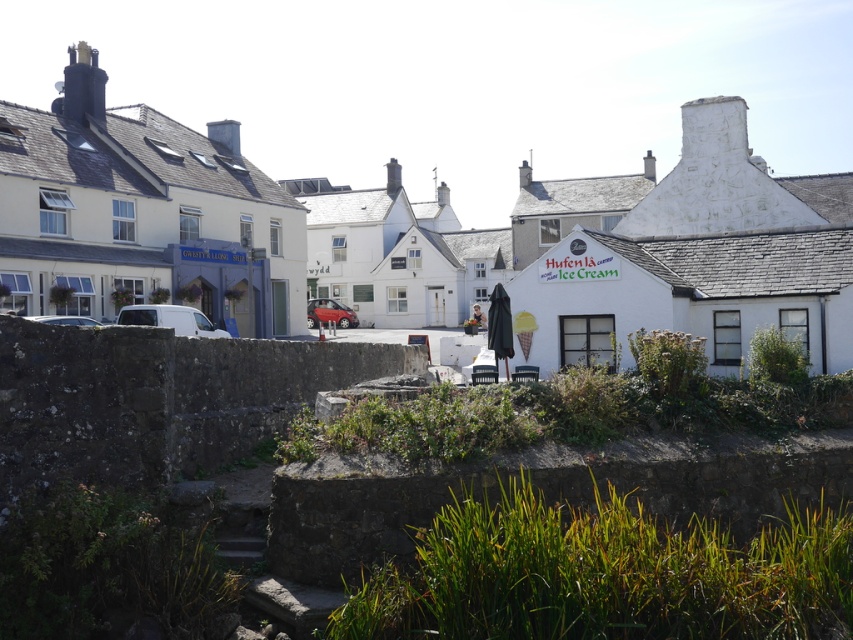
Question: Estimate the real-world distances between objects in this image. Which object is closer to the shiny red car at center?

Choices:
 (A) white matte van at left
 (B) white matte ice cream shop at center
 (C) white matte van at center

Answer: (B)

Question: Is white matte ice cream shop at center above shiny red car at center?

Choices:
 (A) no
 (B) yes

Answer: (B)

Question: Which of the following is the farthest from the observer?

Choices:
 (A) (61, 323)
 (B) (322, 314)
 (C) (482, 230)

Answer: (C)

Question: Can you confirm if white matte ice cream shop at center is bigger than white matte van at center?

Choices:
 (A) yes
 (B) no

Answer: (A)

Question: Considering the relative positions of white matte ice cream shop at center and white matte van at center in the image provided, where is white matte ice cream shop at center located with respect to white matte van at center?

Choices:
 (A) above
 (B) below

Answer: (A)

Question: Based on their relative distances, which object is farther from the white matte ice cream shop at center?

Choices:
 (A) shiny red car at center
 (B) white matte van at center
 (C) white matte van at left

Answer: (C)